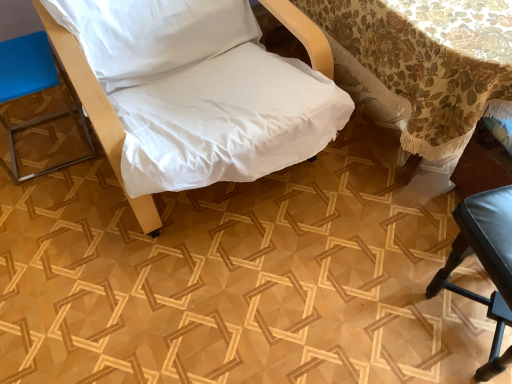
Question: From a real-world perspective, is floral lace tablecloth at upper right physically located above or below black leather chair at lower right, which is the 1th furniture from right to left?

Choices:
 (A) above
 (B) below

Answer: (A)

Question: Is point (404, 77) positioned closer to the camera than point (470, 294)?

Choices:
 (A) farther
 (B) closer

Answer: (B)

Question: Which object is the closest to the floral lace tablecloth at upper right?

Choices:
 (A) black leather chair at lower right, placed as the third furniture when sorted from left to right
 (B) blue leather stool at left, the 1th furniture when ordered from left to right
 (C) white fabric chair at center, which is counted as the 2th furniture, starting from the left

Answer: (A)

Question: Considering the real-world distances, which object is closest to the black leather chair at lower right, placed as the third furniture when sorted from left to right?

Choices:
 (A) floral lace tablecloth at upper right
 (B) blue leather stool at left, the 1th furniture when ordered from left to right
 (C) white fabric chair at center, which is counted as the 2th furniture, starting from the left

Answer: (A)